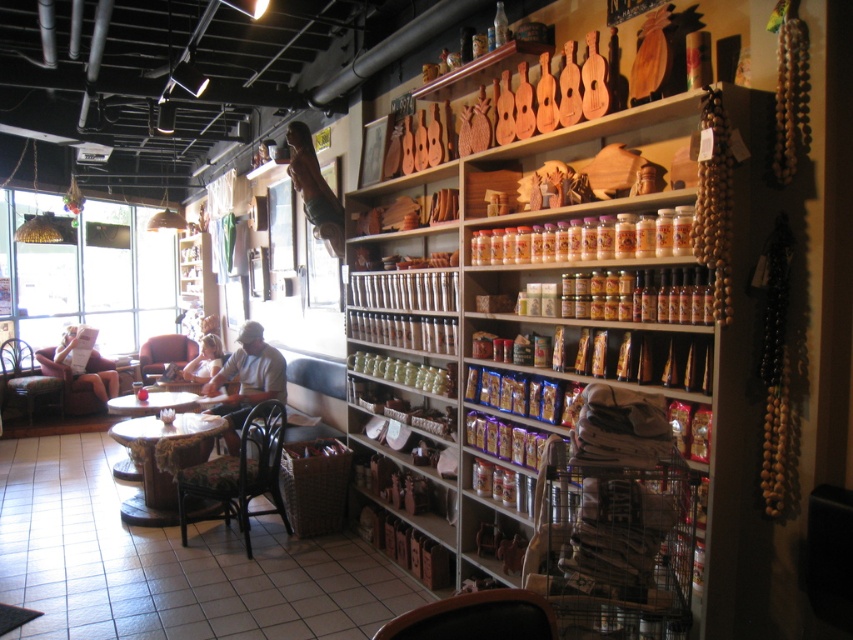
You are a customer entering the shop and want to sit down to try on a hat. You see a dark brown wood chair at lower left and a wooden chair at left. Which chair is shorter and more suitable for a child to sit on?

The dark brown wood chair at lower left is shorter than the wooden chair at left, making it more suitable for a child to sit on.

You are standing at the entrance of the shop and see the point marked at coordinates (161, 460). What object is located at that point?

The point at coordinates (161, 460) corresponds to the wooden table at center.